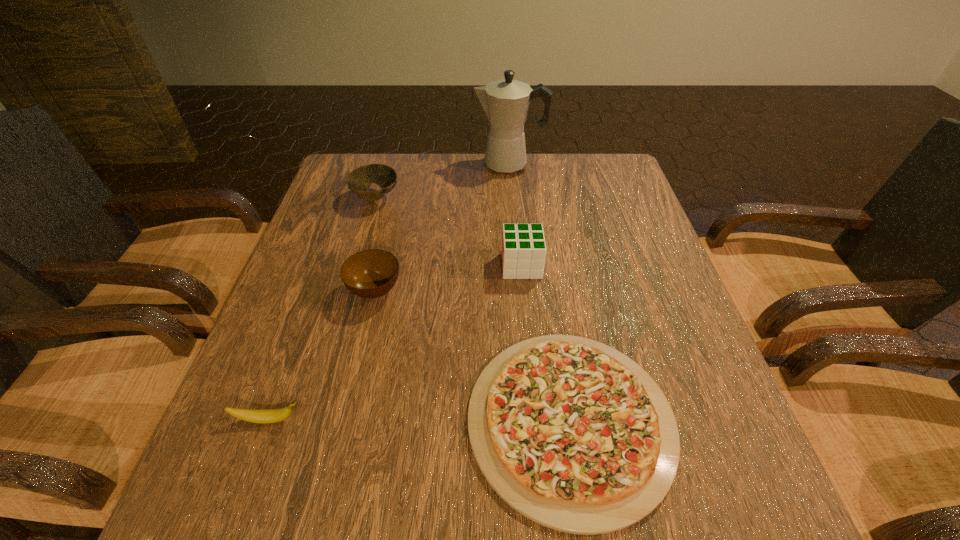
I want to click on object that is at the far left corner, so pyautogui.click(x=359, y=181).

Where is `object located in the near right corner section of the desktop`? This screenshot has height=540, width=960. object located in the near right corner section of the desktop is located at coordinates (574, 435).

This screenshot has height=540, width=960. In the image, there is a desktop. Identify the location of free space at the far edge. (492, 197).

Where is `vacant area at the left edge`? The height and width of the screenshot is (540, 960). vacant area at the left edge is located at coordinates pos(273,460).

Locate an element on the screen. The width and height of the screenshot is (960, 540). free space at the right edge of the desktop is located at coordinates (604, 211).

The width and height of the screenshot is (960, 540). I want to click on blank space at the far right corner of the desktop, so click(613, 156).

Image resolution: width=960 pixels, height=540 pixels. In order to click on free region at the near right corner in this screenshot , I will do `click(705, 481)`.

You are a GUI agent. You are given a task and a screenshot of the screen. Output one action in this format:
    pyautogui.click(x=<x>, y=<y>)
    Task: Click on the free space between the cube and the banana
    The width and height of the screenshot is (960, 540).
    Given the screenshot: What is the action you would take?
    pyautogui.click(x=396, y=343)

At what (x,y) coordinates should I click in order to perform the action: click on free space between the cube and the fifth nearest object. Please return your answer as a coordinate pair (x, y). The width and height of the screenshot is (960, 540). Looking at the image, I should click on (448, 232).

Where is `unoccupied area between the banana and the farther bowl`? The height and width of the screenshot is (540, 960). unoccupied area between the banana and the farther bowl is located at coordinates (323, 309).